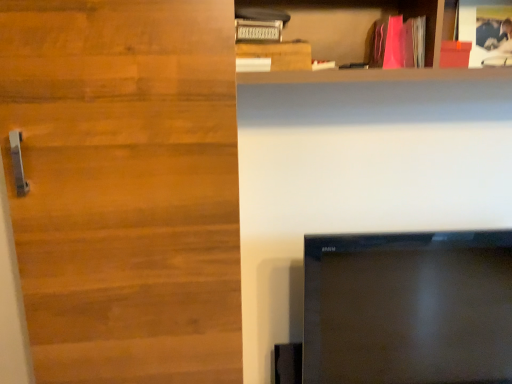
Question: Is matte wooden shelf at upper right in front of or behind pink matte book at upper right in the image?

Choices:
 (A) behind
 (B) front

Answer: (B)

Question: From the image's perspective, is matte wooden shelf at upper right positioned above or below pink matte book at upper right?

Choices:
 (A) above
 (B) below

Answer: (B)

Question: Which object is positioned farthest from the black glossy tv at lower right?

Choices:
 (A) wooden door at left
 (B) matte wooden shelf at upper right
 (C) wooden plank at upper center
 (D) pink matte book at upper right

Answer: (C)

Question: Estimate the real-world distances between objects in this image. Which object is closer to the pink matte book at upper right?

Choices:
 (A) wooden plank at upper center
 (B) black glossy tv at lower right
 (C) wooden door at left
 (D) matte wooden shelf at upper right

Answer: (D)